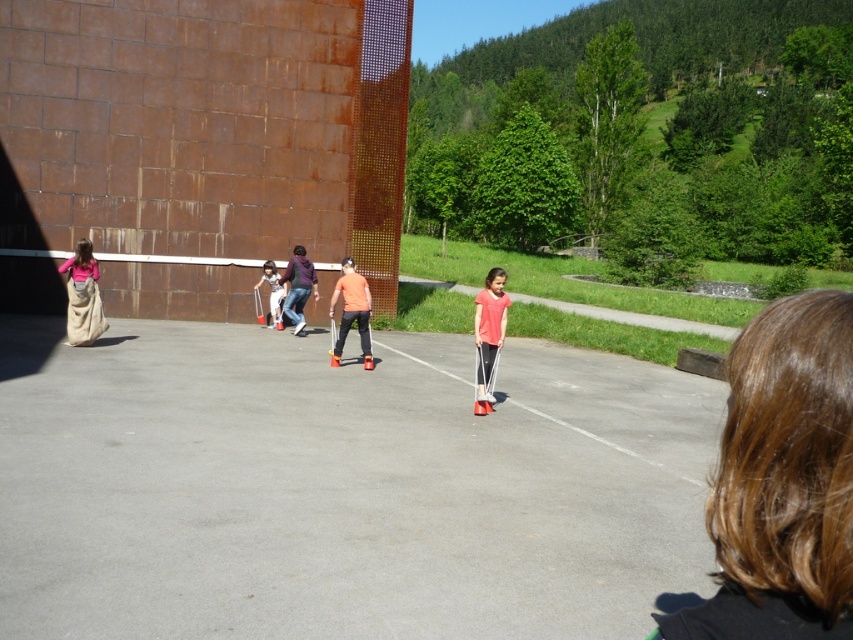
Between matte orange shirt at center and matte white pants at center, which one is positioned higher?

matte white pants at center is above.

Which is in front, point (306, 269) or point (276, 294)?

Point (306, 269) is in front.

The height and width of the screenshot is (640, 853). What do you see at coordinates (299, 288) in the screenshot?
I see `matte orange shirt at center` at bounding box center [299, 288].

I want to click on matte orange shirt at center, so click(299, 288).

Can you confirm if orange matte shirt at center is shorter than matte white pants at center?

Incorrect, orange matte shirt at center's height does not fall short of matte white pants at center's.

Which is above, orange matte shirt at center or matte white pants at center?

matte white pants at center is above.

Which is behind, point (334, 358) or point (254, 284)?

The point (254, 284) is behind.

You are a GUI agent. You are given a task and a screenshot of the screen. Output one action in this format:
    pyautogui.click(x=<x>, y=<y>)
    Task: Click on the orange matte shirt at center
    Image resolution: width=853 pixels, height=640 pixels.
    Given the screenshot: What is the action you would take?
    pyautogui.click(x=351, y=310)

Is point (494, 268) positioned after point (270, 292)?

No, (494, 268) is in front of (270, 292).

Between point (480, 371) and point (281, 298), which one is positioned behind?

Point (281, 298)

What do you see at coordinates (489, 326) in the screenshot? The image size is (853, 640). I see `pink matte shirt at center` at bounding box center [489, 326].

What are the coordinates of `pink matte shirt at center` in the screenshot? It's located at [x=489, y=326].